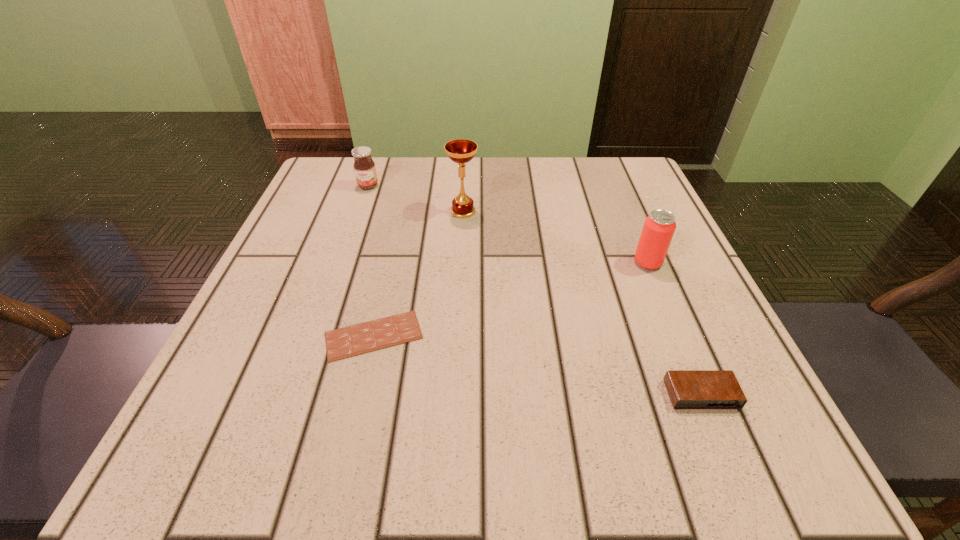
Where is `object situated at the far left corner`? object situated at the far left corner is located at coordinates (364, 167).

Locate an element on the screen. Image resolution: width=960 pixels, height=540 pixels. free space at the far edge is located at coordinates (552, 171).

At what (x,y) coordinates should I click in order to perform the action: click on free space at the near edge of the desktop. Please return your answer as a coordinate pair (x, y). The width and height of the screenshot is (960, 540). Looking at the image, I should click on (390, 422).

Find the location of a particular element. The image size is (960, 540). free region at the left edge is located at coordinates (345, 215).

In the image, there is a desktop. At what (x,y) coordinates should I click in order to perform the action: click on blank space at the right edge. Please return your answer as a coordinate pair (x, y). Image resolution: width=960 pixels, height=540 pixels. Looking at the image, I should click on (633, 215).

The height and width of the screenshot is (540, 960). Find the location of `vacant region at the far left corner of the desktop`. vacant region at the far left corner of the desktop is located at coordinates (357, 188).

Where is `vacant point at the near left corner`? The height and width of the screenshot is (540, 960). vacant point at the near left corner is located at coordinates (257, 456).

At what (x,y) coordinates should I click in order to perform the action: click on blank space at the far right corner of the desktop. Please return your answer as a coordinate pair (x, y). Looking at the image, I should click on (640, 178).

The image size is (960, 540). In order to click on free space between the beer can and the alarm clock in this screenshot , I will do `click(674, 329)`.

Locate an element on the screen. Image resolution: width=960 pixels, height=540 pixels. vacant area that lies between the chocolate bar and the fourth shortest object is located at coordinates (511, 299).